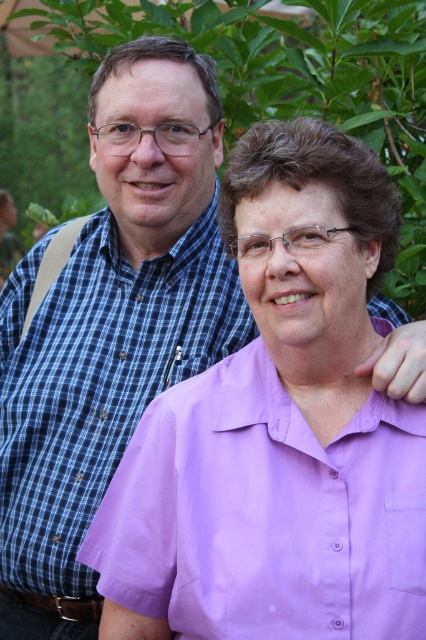
Question: Is lavender smooth shirt at center behind purple cotton shirt at center?

Choices:
 (A) yes
 (B) no

Answer: (B)

Question: Which of the following is the closest to the observer?

Choices:
 (A) lavender smooth shirt at center
 (B) purple cotton shirt at center

Answer: (A)

Question: Does lavender smooth shirt at center have a lesser width compared to purple cotton shirt at center?

Choices:
 (A) yes
 (B) no

Answer: (B)

Question: Which object is farther from the camera taking this photo?

Choices:
 (A) purple cotton shirt at center
 (B) lavender smooth shirt at center

Answer: (A)

Question: Can you confirm if lavender smooth shirt at center is positioned above purple cotton shirt at center?

Choices:
 (A) no
 (B) yes

Answer: (A)